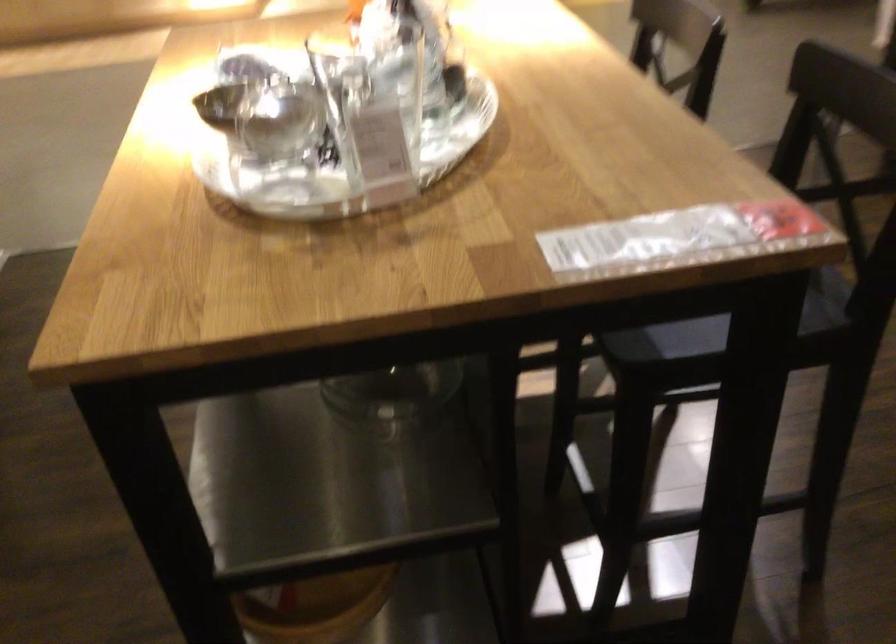
Describe the element at coordinates (721, 341) in the screenshot. I see `the black chair sitting surface` at that location.